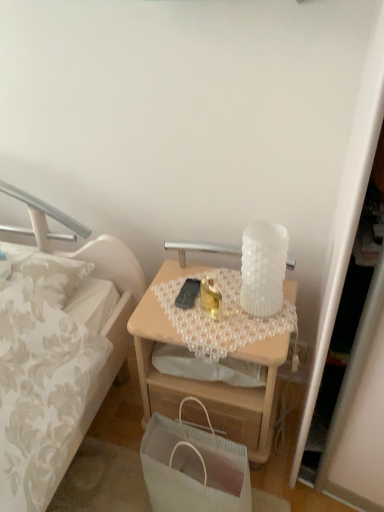
At what (x,y) coordinates should I click in order to perform the action: click on blank space situated above light wood desk at center (from a real-world perspective). Please return your answer as a coordinate pair (x, y). Image resolution: width=384 pixels, height=512 pixels. Looking at the image, I should click on (214, 305).